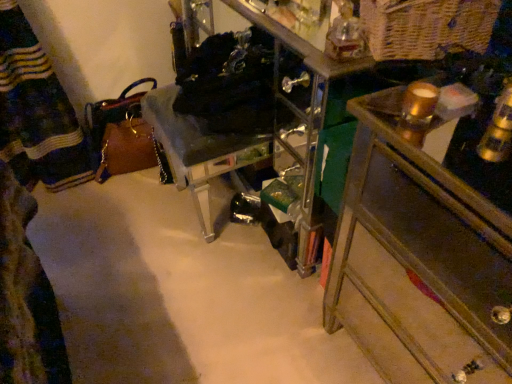
This screenshot has width=512, height=384. Identify the location of vacant space positioned to the left of wooden chest of drawers at right. (263, 318).